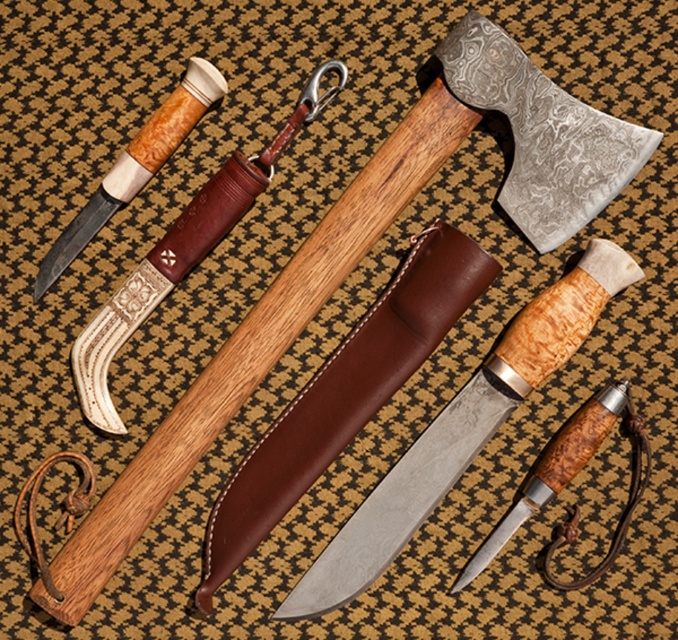
Question: Which of the following is the farthest from the observer?

Choices:
 (A) matte silver blade at center
 (B) matte bone-handled dagger at upper left

Answer: (A)

Question: Is matte silver knife at center smaller than matte white bone-handled knife at upper left?

Choices:
 (A) no
 (B) yes

Answer: (B)

Question: Does matte silver blade at center have a larger size compared to matte bone-handled dagger at upper left?

Choices:
 (A) no
 (B) yes

Answer: (B)

Question: Considering the relative positions of matte silver blade at center and matte white bone-handled knife at upper left in the image provided, where is matte silver blade at center located with respect to matte white bone-handled knife at upper left?

Choices:
 (A) left
 (B) right

Answer: (B)

Question: Which of the following is the closest to the observer?

Choices:
 (A) matte white bone-handled knife at upper left
 (B) matte silver knife at center
 (C) matte bone-handled dagger at upper left
 (D) matte silver blade at center

Answer: (C)

Question: Which of these objects is positioned closest to the matte white bone-handled knife at upper left?

Choices:
 (A) matte silver knife at center
 (B) matte silver blade at center
 (C) matte brown wooden dagger at center

Answer: (A)